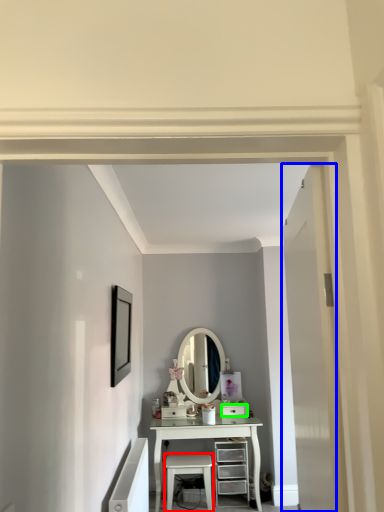
Question: Based on their relative distances, which object is farther from stool (highlighted by a red box)? Choose from door (highlighted by a blue box) and drawer (highlighted by a green box).

Choices:
 (A) door
 (B) drawer

Answer: (A)